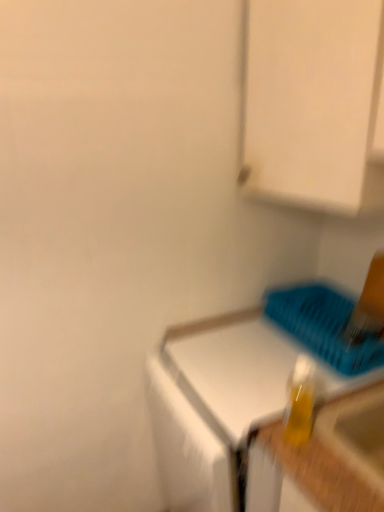
Question: Looking at the image, does white matte cabinet at upper right seem bigger or smaller compared to white glossy countertop at center?

Choices:
 (A) small
 (B) big

Answer: (A)

Question: Is point (281, 138) closer or farther from the camera than point (190, 481)?

Choices:
 (A) farther
 (B) closer

Answer: (A)

Question: Which object is the closest to the white matte cabinet at upper right?

Choices:
 (A) translucent yellow bottle at lower right
 (B) white glossy countertop at center
 (C) blue plastic basket at lower right

Answer: (C)

Question: Which object is positioned farthest from the white glossy countertop at center?

Choices:
 (A) white matte cabinet at upper right
 (B) blue plastic basket at lower right
 (C) translucent yellow bottle at lower right

Answer: (A)